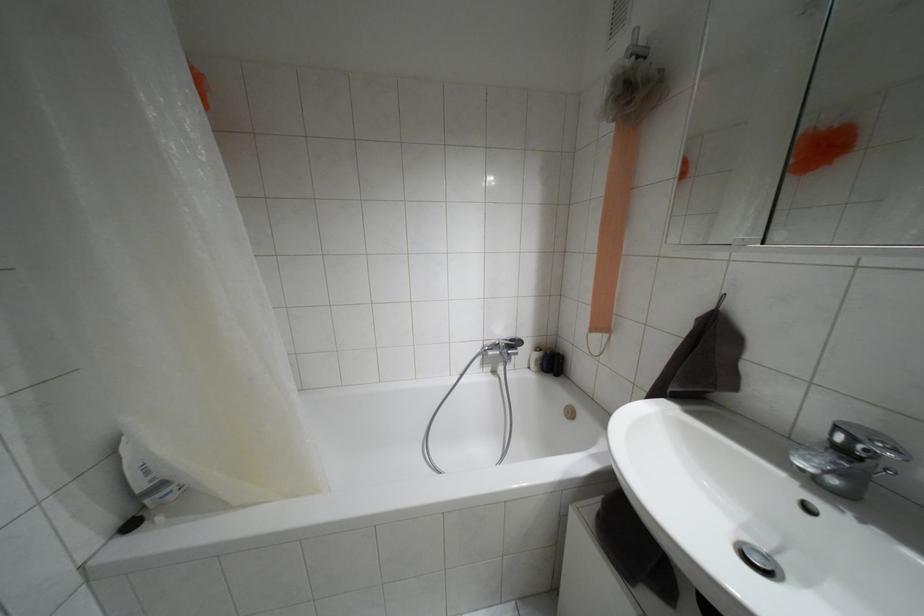
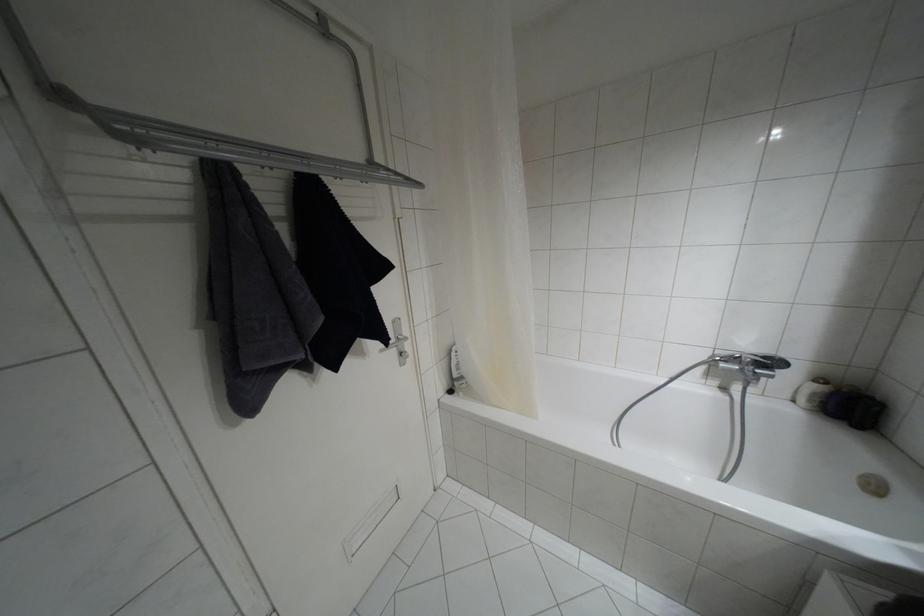
In the second image, find the point that corresponds to [511,339] in the first image.

(763, 357)